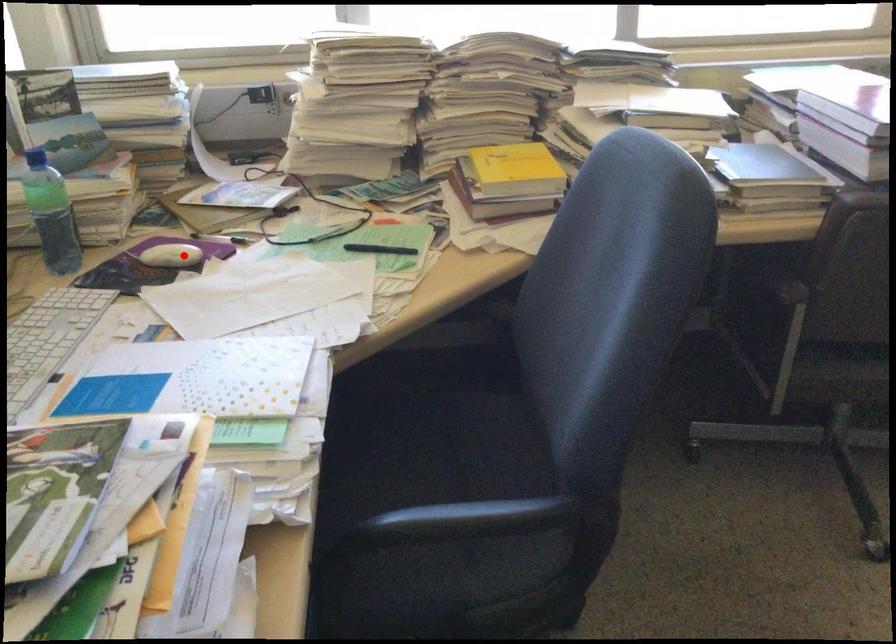
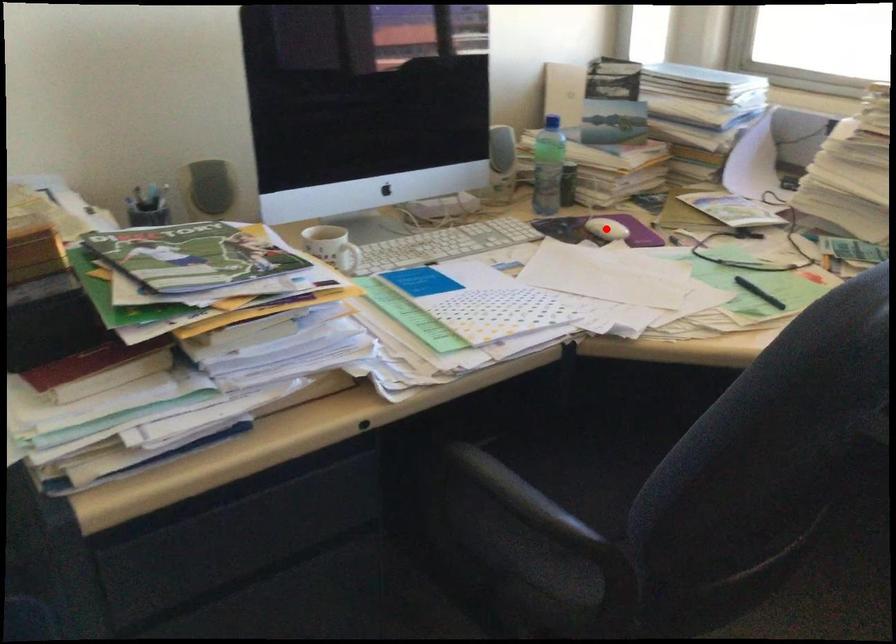
I am providing you with two images of the same scene from different viewpoints. A red point is marked on the first image and another point is marked on the second image. Is the red point in image1 aligned with the point shown in image2?

Yes